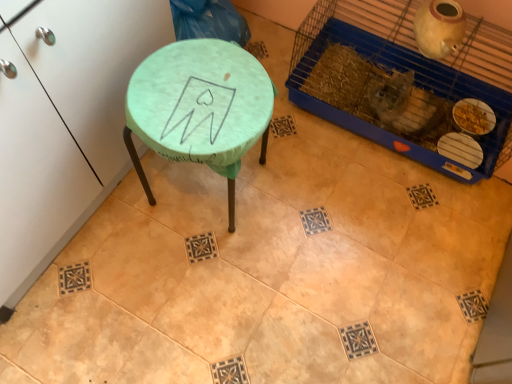
You are a GUI agent. You are given a task and a screenshot of the screen. Output one action in this format:
    pyautogui.click(x=<x>, y=<y>)
    Task: Click on the blue plastic bird cage at upper right
    This screenshot has height=384, width=512.
    Given the screenshot: What is the action you would take?
    pyautogui.click(x=404, y=77)

Considering the sizes of blue plastic bird cage at upper right and green fabric-covered stool at upper left in the image, is blue plastic bird cage at upper right taller or shorter than green fabric-covered stool at upper left?

blue plastic bird cage at upper right is shorter than green fabric-covered stool at upper left.

From the image's perspective, is blue plastic bird cage at upper right under green fabric-covered stool at upper left?

Actually, blue plastic bird cage at upper right appears above green fabric-covered stool at upper left in the image.

Which is in front, blue plastic bird cage at upper right or green fabric-covered stool at upper left?

Positioned in front is green fabric-covered stool at upper left.

Between green fabric-covered stool at upper left and blue plastic bird cage at upper right, which one has less height?

Standing shorter between the two is blue plastic bird cage at upper right.

Consider the image. From a real-world perspective, is green fabric-covered stool at upper left under blue plastic bird cage at upper right?

No, from a real-world perspective, green fabric-covered stool at upper left is not below blue plastic bird cage at upper right.

In the scene shown: Is blue plastic bird cage at upper right at the back of green fabric-covered stool at upper left?

green fabric-covered stool at upper left does not have its back to blue plastic bird cage at upper right.

Where is `bird cage lying above the matte green stool at center (from the image's perspective)`? The height and width of the screenshot is (384, 512). bird cage lying above the matte green stool at center (from the image's perspective) is located at coordinates (404, 77).

Is matte green stool at center looking in the opposite direction of blue plastic bird cage at upper right?

No, matte green stool at center's orientation is not away from blue plastic bird cage at upper right.

Considering the relative sizes of matte green stool at center and blue plastic bird cage at upper right in the image provided, is matte green stool at center thinner than blue plastic bird cage at upper right?

Yes, matte green stool at center is thinner than blue plastic bird cage at upper right.

Can you confirm if matte green stool at center is positioned to the left of blue plastic bird cage at upper right?

Yes, matte green stool at center is to the left of blue plastic bird cage at upper right.

Considering the relative positions of blue plastic bird cage at upper right and matte green stool at center in the image provided, is blue plastic bird cage at upper right in front of matte green stool at center?

No.

Can you confirm if blue plastic bird cage at upper right is smaller than matte green stool at center?

No, blue plastic bird cage at upper right is not smaller than matte green stool at center.

Considering the relative positions of blue plastic bird cage at upper right and matte green stool at center in the image provided, is blue plastic bird cage at upper right to the left or to the right of matte green stool at center?

In the image, blue plastic bird cage at upper right appears on the right side of matte green stool at center.

Is blue plastic bird cage at upper right facing away from matte green stool at center?

blue plastic bird cage at upper right is not turned away from matte green stool at center.

From a real-world perspective, is green fabric-covered stool at upper left above or below matte green stool at center?

In terms of real-world spatial position, green fabric-covered stool at upper left is above matte green stool at center.

Considering the positions of objects green fabric-covered stool at upper left and matte green stool at center in the image provided, who is behind, green fabric-covered stool at upper left or matte green stool at center?

matte green stool at center is further away from the camera.

Between green fabric-covered stool at upper left and matte green stool at center, which one has less height?

matte green stool at center.

Does green fabric-covered stool at upper left appear on the right side of matte green stool at center?

No.

Is matte green stool at center not close to green fabric-covered stool at upper left?

matte green stool at center is near green fabric-covered stool at upper left, not far away.

From the image's perspective, does matte green stool at center appear higher than green fabric-covered stool at upper left?

Incorrect, from the image's perspective, matte green stool at center is lower than green fabric-covered stool at upper left.

Is matte green stool at center facing away from green fabric-covered stool at upper left?

Yes, matte green stool at center is positioned with its back facing green fabric-covered stool at upper left.

Considering the sizes of objects matte green stool at center and green fabric-covered stool at upper left in the image provided, who is bigger, matte green stool at center or green fabric-covered stool at upper left?

Bigger between the two is green fabric-covered stool at upper left.

At what (x,y) coordinates should I click in order to perform the action: click on bird cage on the right of green fabric-covered stool at upper left. Please return your answer as a coordinate pair (x, y). The image size is (512, 384). Looking at the image, I should click on (404, 77).

The height and width of the screenshot is (384, 512). I want to click on furniture above the blue plastic bird cage at upper right (from a real-world perspective), so click(x=67, y=124).

When comparing their distances from blue plastic bird cage at upper right, does matte green stool at center or green fabric-covered stool at upper left seem further?

The object further to blue plastic bird cage at upper right is green fabric-covered stool at upper left.

Which object lies nearer to the anchor point matte green stool at center, blue plastic bird cage at upper right or green fabric-covered stool at upper left?

green fabric-covered stool at upper left is positioned closer to the anchor matte green stool at center.

Estimate the real-world distances between objects in this image. Which object is closer to green fabric-covered stool at upper left, blue plastic bird cage at upper right or matte green stool at center?

The object closer to green fabric-covered stool at upper left is matte green stool at center.

Estimate the real-world distances between objects in this image. Which object is closer to green fabric-covered stool at upper left, matte green stool at center or blue plastic bird cage at upper right?

Among the two, matte green stool at center is located nearer to green fabric-covered stool at upper left.

From the image, which object appears to be farther from blue plastic bird cage at upper right, green fabric-covered stool at upper left or matte green stool at center?

green fabric-covered stool at upper left is positioned further to the anchor blue plastic bird cage at upper right.

Looking at the image, which one is located closer to matte green stool at center, green fabric-covered stool at upper left or blue plastic bird cage at upper right?

green fabric-covered stool at upper left is closer to matte green stool at center.

This screenshot has height=384, width=512. What are the coordinates of `table between green fabric-covered stool at upper left and blue plastic bird cage at upper right in the horizontal direction` in the screenshot? It's located at (200, 107).